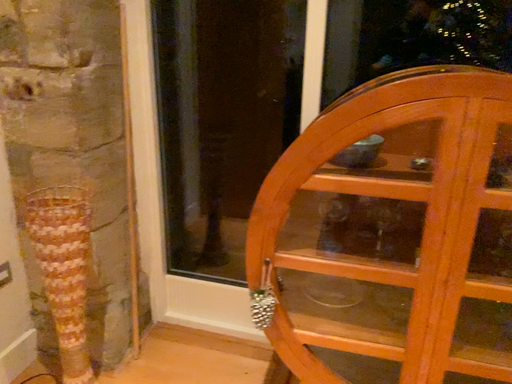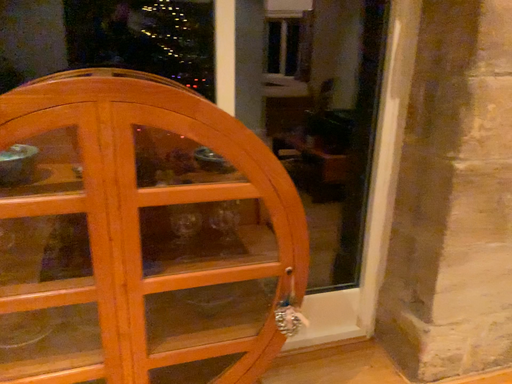
Question: Which way did the camera rotate in the video?

Choices:
 (A) rotated right
 (B) rotated left

Answer: (A)